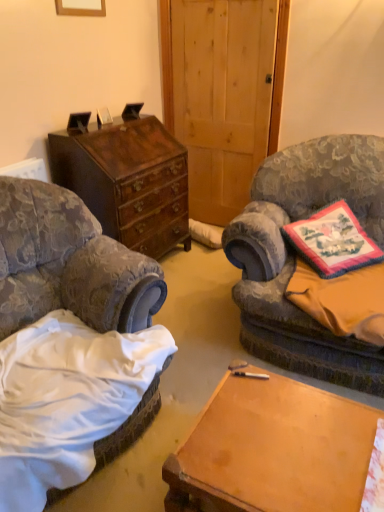
Question: Is velvet floral chair at right, the 1th chair in the right-to-left sequence, facing away from mahogany wood chest of drawers at left?

Choices:
 (A) yes
 (B) no

Answer: (B)

Question: Are velvet floral chair at right, the 1th chair in the right-to-left sequence, and mahogany wood chest of drawers at left far apart?

Choices:
 (A) yes
 (B) no

Answer: (B)

Question: Does velvet floral chair at right, the 1th chair in the right-to-left sequence, have a smaller size compared to mahogany wood chest of drawers at left?

Choices:
 (A) no
 (B) yes

Answer: (A)

Question: From a real-world perspective, is velvet floral chair at right, the second chair in the left-to-right sequence, under mahogany wood chest of drawers at left?

Choices:
 (A) yes
 (B) no

Answer: (B)

Question: Is velvet floral chair at right, the 1th chair in the right-to-left sequence, shorter than mahogany wood chest of drawers at left?

Choices:
 (A) yes
 (B) no

Answer: (B)

Question: Considering the relative sizes of velvet floral chair at right, the second chair in the left-to-right sequence, and mahogany wood chest of drawers at left in the image provided, is velvet floral chair at right, the second chair in the left-to-right sequence, thinner than mahogany wood chest of drawers at left?

Choices:
 (A) yes
 (B) no

Answer: (B)

Question: Does wooden picture frame at upper center touch velvet-patterned armchair at left, which appears as the 2th chair when viewed from the right?

Choices:
 (A) no
 (B) yes

Answer: (A)

Question: From the image's perspective, is wooden picture frame at upper center beneath velvet-patterned armchair at left, which appears as the 2th chair when viewed from the right?

Choices:
 (A) yes
 (B) no

Answer: (B)

Question: Can you confirm if wooden picture frame at upper center is thinner than velvet-patterned armchair at left, which is counted as the 1th chair, starting from the left?

Choices:
 (A) yes
 (B) no

Answer: (A)

Question: From the image's perspective, is wooden picture frame at upper center above velvet-patterned armchair at left, which is counted as the 1th chair, starting from the left?

Choices:
 (A) no
 (B) yes

Answer: (B)

Question: Could you tell me if wooden picture frame at upper center is facing velvet-patterned armchair at left, which appears as the 2th chair when viewed from the right?

Choices:
 (A) no
 (B) yes

Answer: (A)

Question: Can we say wooden picture frame at upper center lies outside velvet-patterned armchair at left, which appears as the 2th chair when viewed from the right?

Choices:
 (A) no
 (B) yes

Answer: (B)

Question: Considering the relative sizes of mahogany wood chest of drawers at left and velvet floral chair at right, the second chair in the left-to-right sequence, in the image provided, is mahogany wood chest of drawers at left taller than velvet floral chair at right, the second chair in the left-to-right sequence,?

Choices:
 (A) no
 (B) yes

Answer: (A)